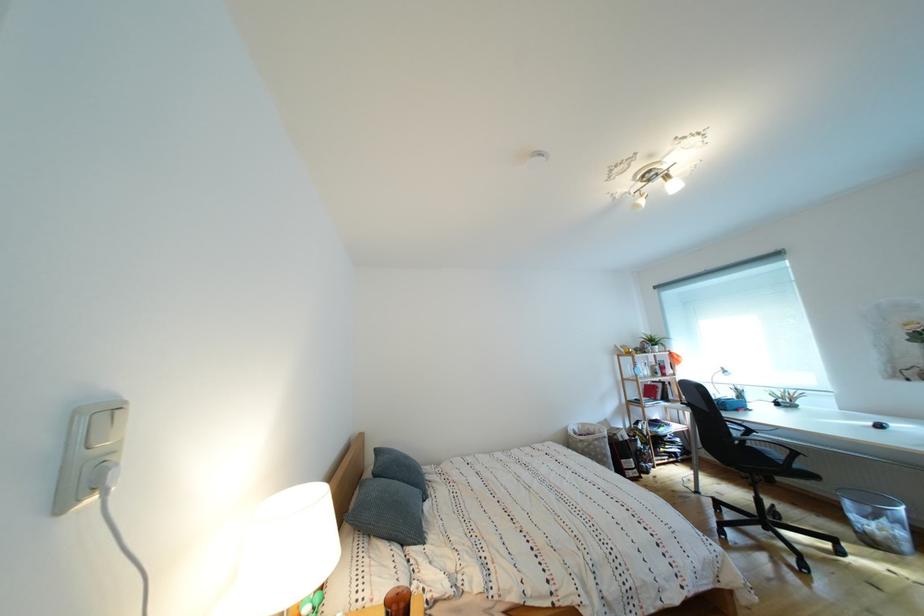
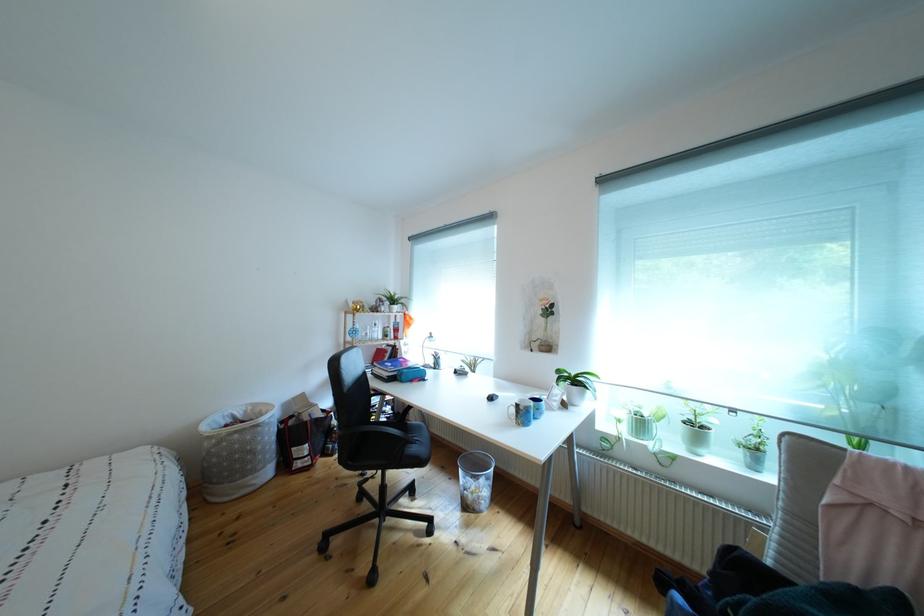
Where in the second image is the point corresponding to the point at 650,451 from the first image?

(346, 428)